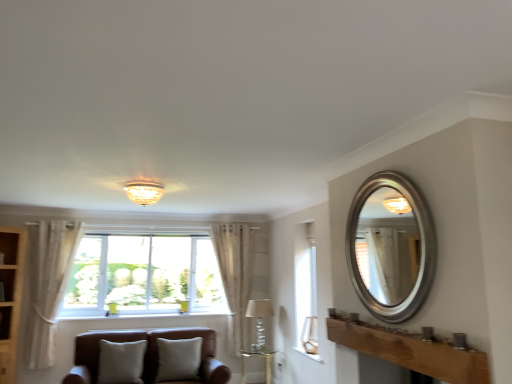
Question: Is sheer fabric curtain at center, which appears as the first curtain when viewed from the back, not close to white textured stone at lower center?

Choices:
 (A) yes
 (B) no

Answer: (A)

Question: Does sheer fabric curtain at center, which appears as the first curtain when viewed from the back, have a greater width compared to white textured stone at lower center?

Choices:
 (A) no
 (B) yes

Answer: (B)

Question: From the image's perspective, is sheer fabric curtain at center, which is the 1th curtain from right to left, over white textured stone at lower center?

Choices:
 (A) yes
 (B) no

Answer: (A)

Question: Is sheer fabric curtain at center, acting as the second curtain starting from the front, located outside white textured stone at lower center?

Choices:
 (A) no
 (B) yes

Answer: (B)

Question: Is sheer fabric curtain at center, acting as the second curtain starting from the front, shorter than white textured stone at lower center?

Choices:
 (A) yes
 (B) no

Answer: (B)

Question: Does sheer fabric curtain at center, which is the 1th curtain from right to left, contain white textured stone at lower center?

Choices:
 (A) yes
 (B) no

Answer: (B)

Question: Considering the relative sizes of matte glass lampshade at upper center, placed as the 3th lamp when sorted from back to front, and beige fabric pillow at lower left, the 1th pillow when ordered from left to right, in the image provided, is matte glass lampshade at upper center, placed as the 3th lamp when sorted from back to front, smaller than beige fabric pillow at lower left, the 1th pillow when ordered from left to right,?

Choices:
 (A) no
 (B) yes

Answer: (B)

Question: Does matte glass lampshade at upper center, the third lamp from the right, have a greater height compared to beige fabric pillow at lower left, marked as the 2th pillow in a right-to-left arrangement?

Choices:
 (A) no
 (B) yes

Answer: (A)

Question: Is matte glass lampshade at upper center, the third lamp from the right, oriented away from beige fabric pillow at lower left, marked as the 2th pillow in a right-to-left arrangement?

Choices:
 (A) yes
 (B) no

Answer: (B)

Question: Does matte glass lampshade at upper center, acting as the 3th lamp starting from the bottom, have a lesser height compared to beige fabric pillow at lower left, marked as the 2th pillow in a right-to-left arrangement?

Choices:
 (A) yes
 (B) no

Answer: (A)

Question: Does matte glass lampshade at upper center, the third lamp from the right, turn towards beige fabric pillow at lower left, the 1th pillow when ordered from left to right?

Choices:
 (A) no
 (B) yes

Answer: (A)

Question: Is matte glass lampshade at upper center, positioned as the 1th lamp in top-to-bottom order, further to camera compared to beige fabric pillow at lower left, the 1th pillow when ordered from left to right?

Choices:
 (A) yes
 (B) no

Answer: (B)

Question: From the image's perspective, is wooden cabinet at left on sheer fabric curtain at center, which appears as the first curtain when viewed from the back?

Choices:
 (A) no
 (B) yes

Answer: (A)